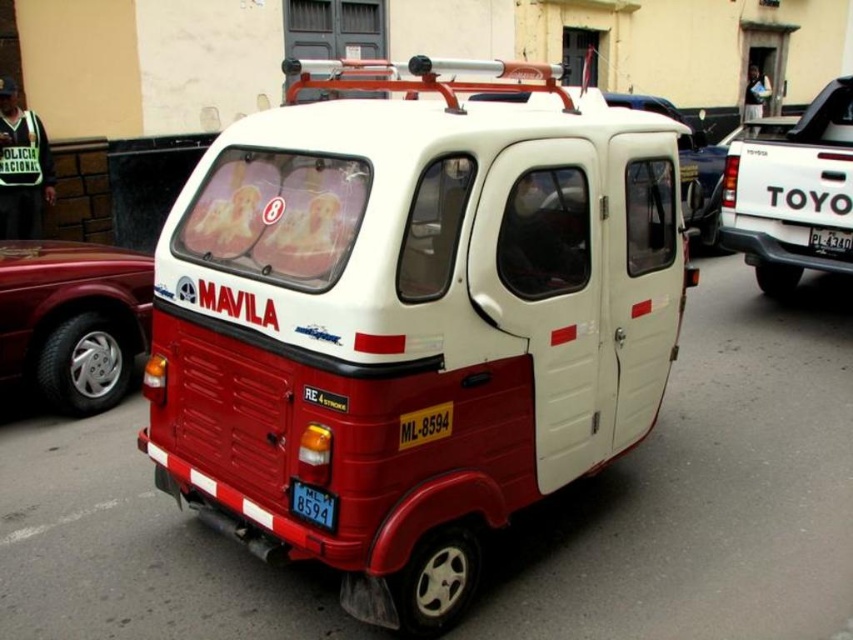
Based on the photo, which of these two, white matte pickup truck at right or black plastic license plate at lower center, stands taller?

Standing taller between the two is white matte pickup truck at right.

Is point (833, 97) behind point (317, 492)?

That is True.

The height and width of the screenshot is (640, 853). I want to click on white matte pickup truck at right, so click(791, 193).

Does matte red car at lower left have a greater height compared to black plastic license plate at center?

Yes.

Where is `matte red car at lower left`? The width and height of the screenshot is (853, 640). matte red car at lower left is located at coordinates (73, 321).

Is white matte van at center thinner than black plastic license plate at center?

Indeed, white matte van at center has a lesser width compared to black plastic license plate at center.

Does white matte van at center appear on the left side of black plastic license plate at center?

Yes, white matte van at center is to the left of black plastic license plate at center.

Does point (705, 138) come behind point (811, 227)?

Yes, point (705, 138) is behind point (811, 227).

Find the location of `white matte van at center`. white matte van at center is located at coordinates (701, 188).